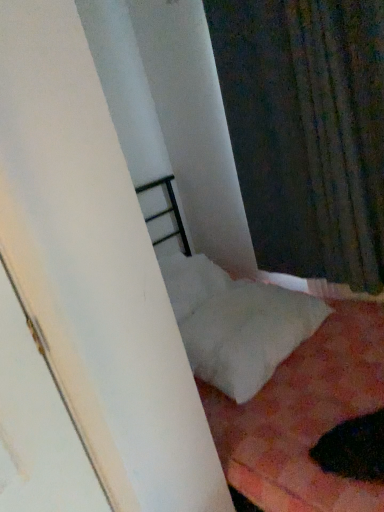
Question: In terms of height, does white soft pillow at lower right look taller or shorter compared to dark textured fabric at upper right?

Choices:
 (A) short
 (B) tall

Answer: (A)

Question: Is white soft pillow at lower right situated inside dark textured fabric at upper right or outside?

Choices:
 (A) outside
 (B) inside

Answer: (A)

Question: Which object is positioned farthest from the dark textured fabric at upper right?

Choices:
 (A) white soft bed at lower right
 (B) white soft pillow at lower right

Answer: (A)

Question: Estimate the real-world distances between objects in this image. Which object is closer to the dark textured fabric at upper right?

Choices:
 (A) white soft pillow at lower right
 (B) white soft bed at lower right

Answer: (A)